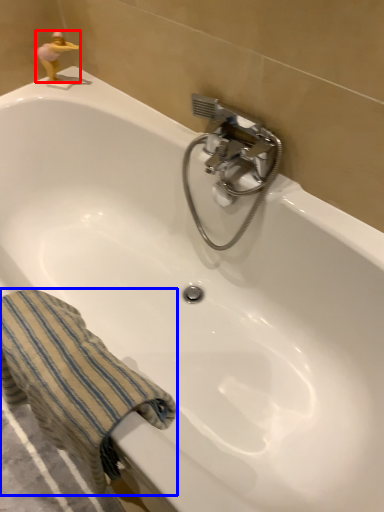
Question: Which object is closer to the camera taking this photo, miniature (highlighted by a red box) or towel/napkin (highlighted by a blue box)?

Choices:
 (A) miniature
 (B) towel/napkin

Answer: (B)